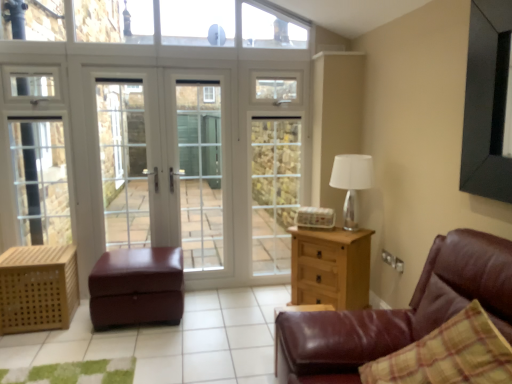
Image resolution: width=512 pixels, height=384 pixels. Identify the location of empty space that is ontop of white glass screen door at center, which ranks as the third screen door in left-to-right order. (276, 55).